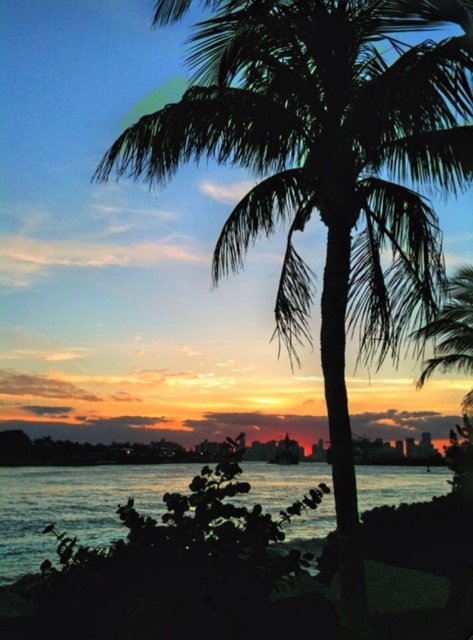
Does dark blue water at lower center appear on the left side of green leafy palm tree at right?

Indeed, dark blue water at lower center is positioned on the left side of green leafy palm tree at right.

Can you confirm if dark blue water at lower center is shorter than green leafy palm tree at right?

No, dark blue water at lower center is not shorter than green leafy palm tree at right.

Does point (50, 506) lie behind point (446, 289)?

That is True.

This screenshot has height=640, width=473. I want to click on dark blue water at lower center, so click(78, 508).

Is silky orange sky at center above green leafy palm tree at right?

Indeed, silky orange sky at center is positioned over green leafy palm tree at right.

Between point (167, 440) and point (456, 445), which one is positioned in front?

Point (167, 440) is in front.

The height and width of the screenshot is (640, 473). Find the location of `silky orange sky at center`. silky orange sky at center is located at coordinates (98, 451).

Consider the image. Between dark blue water at lower center and silky orange sky at center, which one has more height?

With more height is dark blue water at lower center.

Does dark blue water at lower center appear on the right side of silky orange sky at center?

Incorrect, dark blue water at lower center is not on the right side of silky orange sky at center.

The width and height of the screenshot is (473, 640). Describe the element at coordinates (78, 508) in the screenshot. I see `dark blue water at lower center` at that location.

What are the coordinates of `dark blue water at lower center` in the screenshot? It's located at (78, 508).